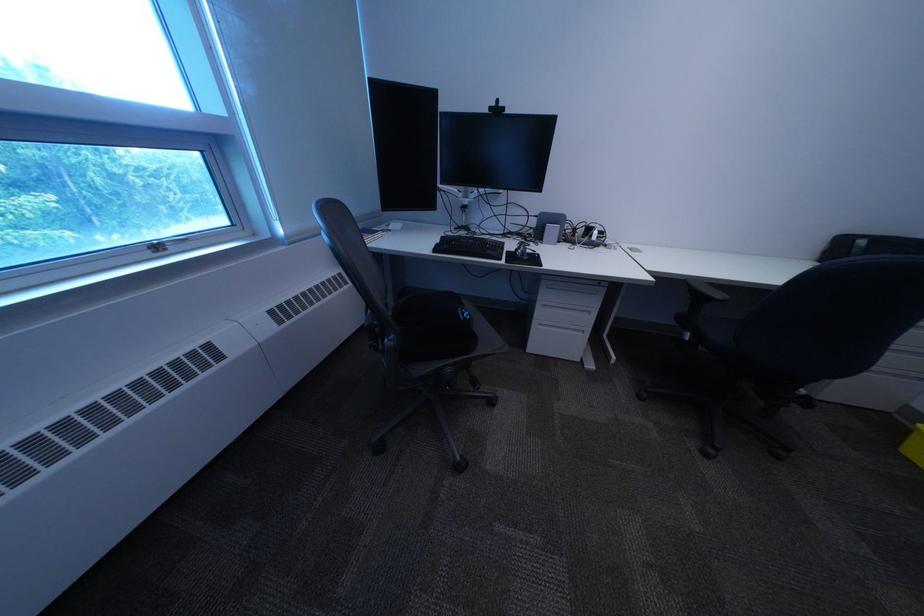
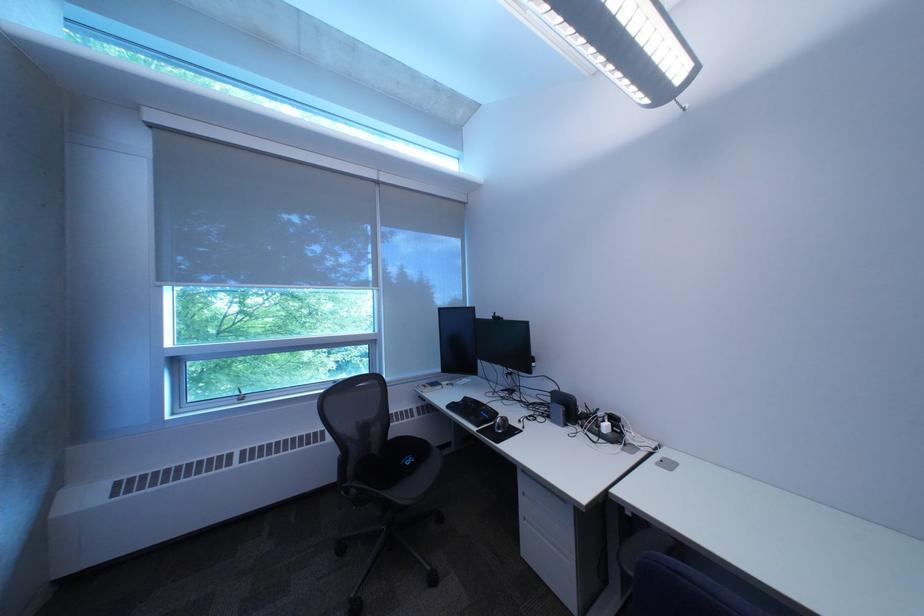
Find the pixel in the second image that matches pixel 511 217 in the first image.

(532, 387)